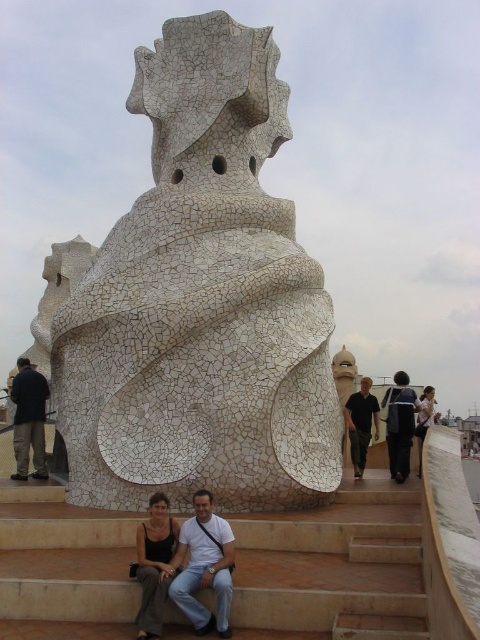
Which of these two, brown stone stairs at lower center or matte black tank top at lower center, stands shorter?

brown stone stairs at lower center

Does brown stone stairs at lower center have a lesser width compared to matte black tank top at lower center?

Incorrect, brown stone stairs at lower center's width is not less than matte black tank top at lower center's.

Which is behind, point (83, 589) or point (156, 602)?

Point (83, 589)

You are a GUI agent. You are given a task and a screenshot of the screen. Output one action in this format:
    pyautogui.click(x=<x>, y=<y>)
    Task: Click on the brown stone stairs at lower center
    The height and width of the screenshot is (640, 480).
    Given the screenshot: What is the action you would take?
    pyautogui.click(x=332, y=570)

Between point (352, 433) and point (21, 403), which one is positioned in front?

Positioned in front is point (21, 403).

Can you confirm if dark blue jeans at center is shorter than dark brown leather jacket at left?

Yes, dark blue jeans at center is shorter than dark brown leather jacket at left.

This screenshot has height=640, width=480. What are the coordinates of `dark blue jeans at center` in the screenshot? It's located at (399, 422).

Does dark brown leather jacket at left have a lesser width compared to dark gray fabric jacket at right?

Yes, dark brown leather jacket at left is thinner than dark gray fabric jacket at right.

Between dark brown leather jacket at left and dark gray fabric jacket at right, which one has more height?

dark brown leather jacket at left is taller.

This screenshot has width=480, height=640. What do you see at coordinates (28, 420) in the screenshot?
I see `dark brown leather jacket at left` at bounding box center [28, 420].

Image resolution: width=480 pixels, height=640 pixels. I want to click on dark brown leather jacket at left, so click(x=28, y=420).